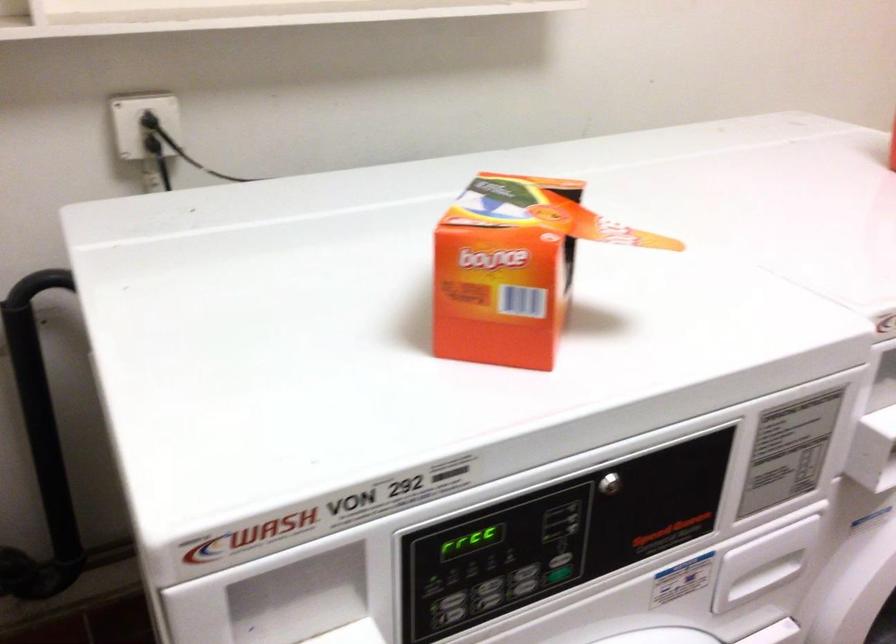
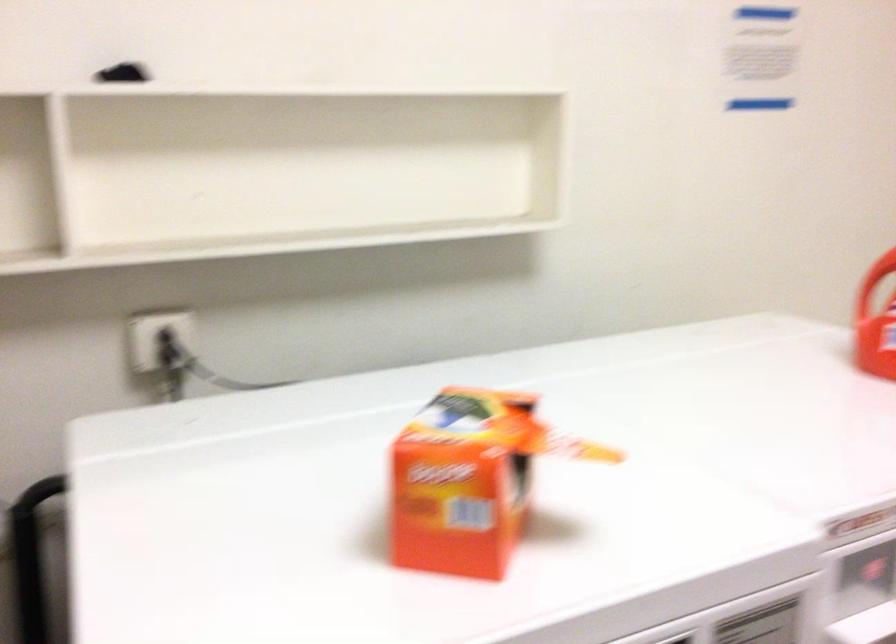
Question: The first image is from the beginning of the video and the second image is from the end. How did the camera likely rotate when shooting the video?

Choices:
 (A) Left
 (B) Right
 (C) Up
 (D) Down

Answer: (C)